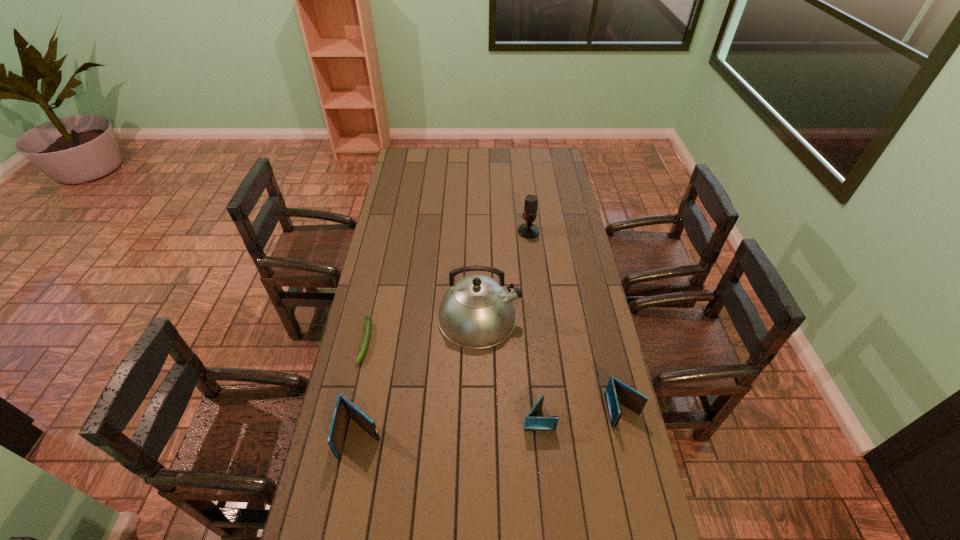
Locate an element on the screen. This screenshot has width=960, height=540. object that is positioned at the right edge is located at coordinates (617, 392).

Find the location of a particular element. The height and width of the screenshot is (540, 960). free region at the far edge is located at coordinates (502, 150).

The width and height of the screenshot is (960, 540). Identify the location of free space at the near edge of the desktop. (491, 509).

At what (x,y) coordinates should I click in order to perform the action: click on free space at the left edge. Please return your answer as a coordinate pair (x, y). Looking at the image, I should click on (410, 261).

Locate an element on the screen. vacant area at the right edge is located at coordinates (602, 406).

What are the coordinates of `vacant space at the far right corner of the desktop` in the screenshot? It's located at click(x=549, y=154).

Locate an element on the screen. The image size is (960, 540). free point between the tallest object and the leftmost wallet is located at coordinates (420, 376).

You are a GUI agent. You are given a task and a screenshot of the screen. Output one action in this format:
    pyautogui.click(x=<x>, y=<y>)
    Task: Click on the vacant region between the kettle and the third shortest object
    
    Given the screenshot: What is the action you would take?
    pyautogui.click(x=551, y=363)

Find the location of a particular element. The width and height of the screenshot is (960, 540). vacant space that is in between the shortest object and the third tallest object is located at coordinates (364, 389).

This screenshot has width=960, height=540. Identify the location of empty space that is in between the shortest wallet and the tallest wallet. (450, 427).